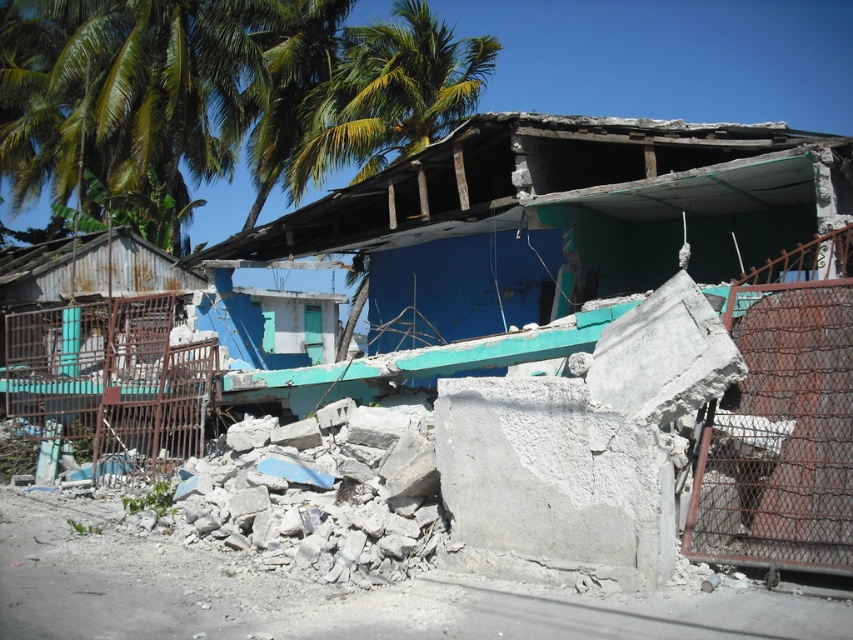
Question: Which object is positioned farthest from the rusty metal fence at left?

Choices:
 (A) rusty metal gate at right
 (B) blue concrete hut at center
 (C) green leafy palm tree at upper center

Answer: (C)

Question: Is green leafy palm tree at upper center above green leafy palm tree at upper left?

Choices:
 (A) no
 (B) yes

Answer: (B)

Question: Which point is closer to the camera?

Choices:
 (A) rusty metal gate at right
 (B) blue concrete hut at center

Answer: (A)

Question: Does rusty metal gate at right have a larger size compared to rusty metal fence at left?

Choices:
 (A) yes
 (B) no

Answer: (B)

Question: Which of the following is the closest to the observer?

Choices:
 (A) blue concrete hut at center
 (B) green leafy palm tree at upper center
 (C) green leafy palm tree at upper left

Answer: (A)

Question: Can you confirm if rusty metal gate at right is wider than green leafy palm tree at upper center?

Choices:
 (A) yes
 (B) no

Answer: (B)